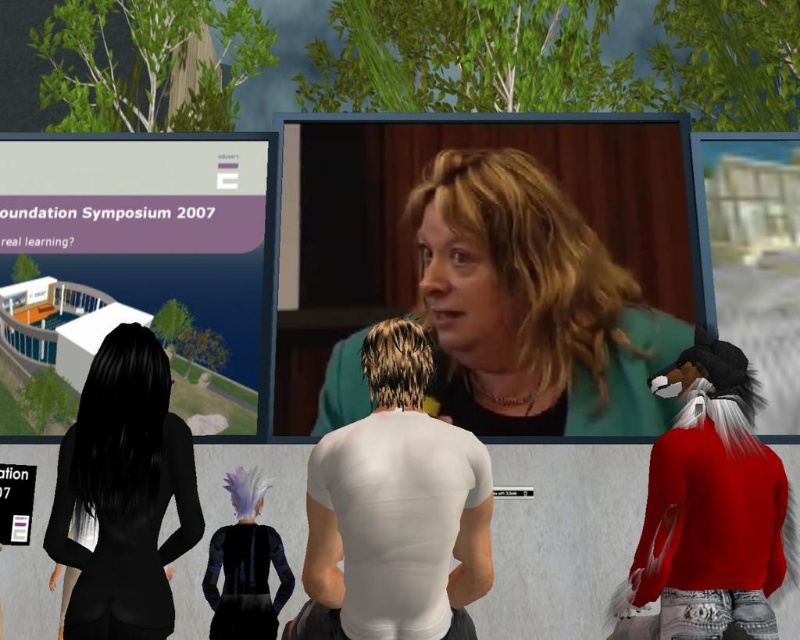
You are attending a virtual conference and need to locate two specific avatars. The first is wearing a white matte shirt at center, and the second is in a black matte suit at lower left. If you face the screen, which avatar is positioned to the right of the other?

The white matte shirt at center is to the right of the black matte suit at lower left.

You are attending a virtual conference and see two avatars wearing the teal fabric jacket at center and the red fuzzy sweater at lower right. Which avatar is positioned to the left of the other?

The teal fabric jacket at center is to the left of the red fuzzy sweater at lower right.

You are an event organizer planning to seat participants in a row for a panel discussion. You need to ensure that the white matte shirt at center and the black matte suit at lower left can be seated without one blocking the other. Considering their heights, which avatar should be seated in the front row to avoid obstruction?

The black matte suit at lower left should be seated in the front row because the white matte shirt at center is much taller. Placing the shorter avatar upfront will prevent the taller one from blocking the view.